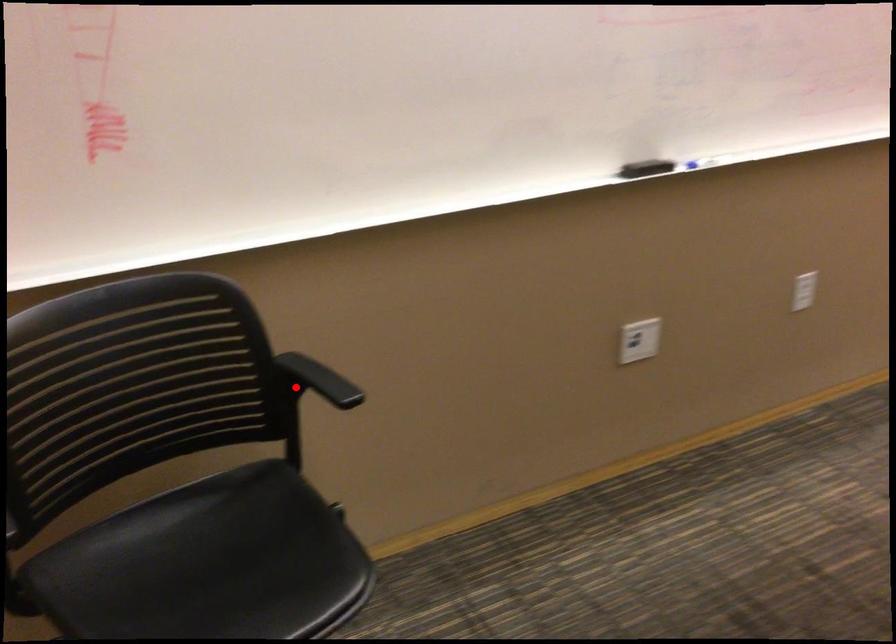
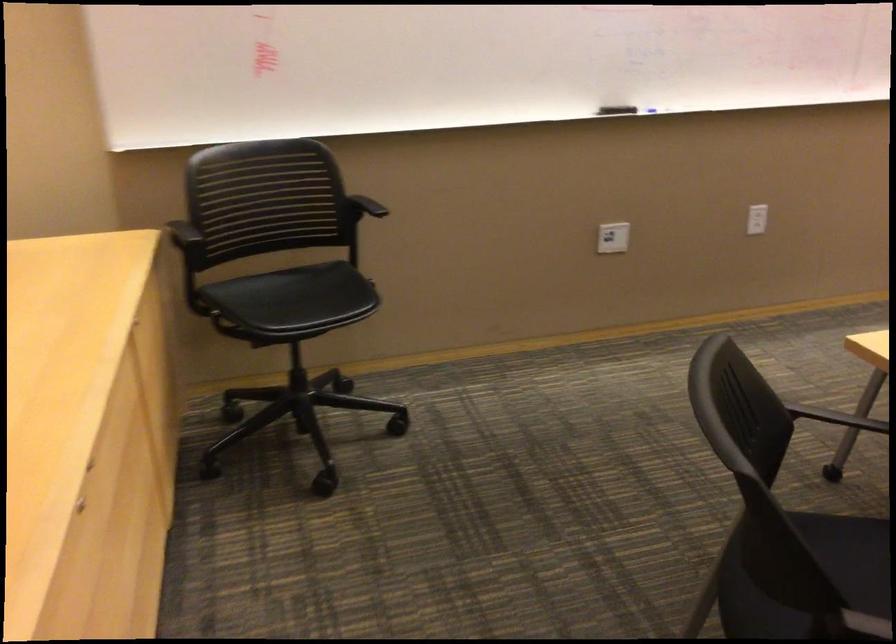
Question: A red point is marked in image1. In image2, is the corresponding 3D point closer to the camera or farther? Reply with the corresponding letter.

Choices:
 (A) The corresponding 3D point is closer.
 (B) The corresponding 3D point is farther.

Answer: (B)